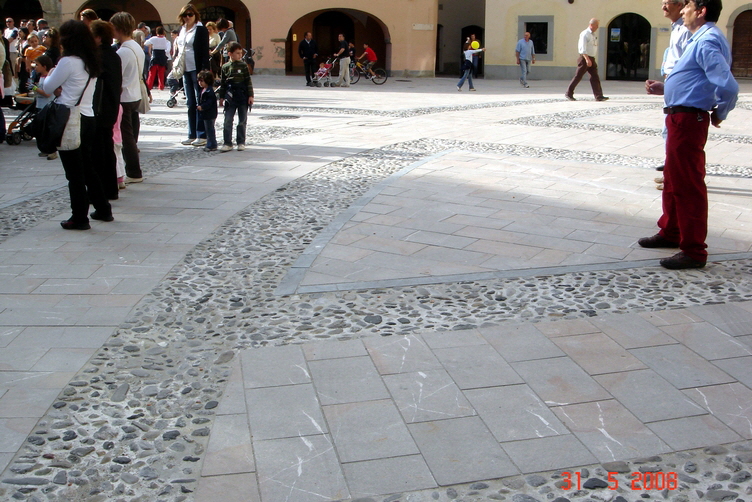
Find the location of a particular element. door is located at coordinates (628, 30).